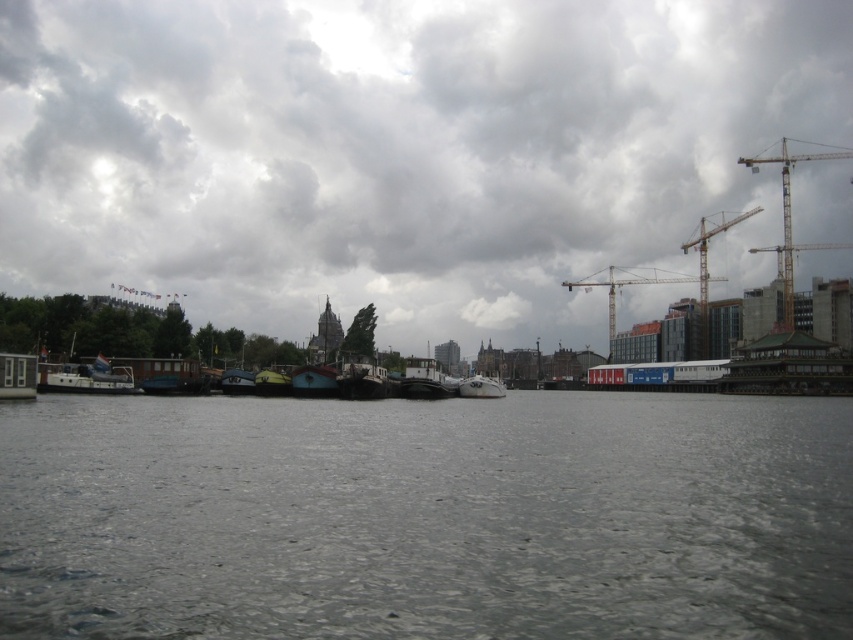
You are a photographer planning to capture the reflection of the teal glossy boat at center in the gray water at center. Based on the scene description, will the reflection be visible?

The gray water at center is below the teal glossy boat at center, so the boat is above the water. Since the water is calm and reflective, the reflection of the teal glossy boat at center should be visible in the gray water at center.

You are standing on the riverbank and want to reach the point marked at coordinates point (132,394). If your maximum comfortable walking distance is 75 meters, will you be able to walk to that point without feeling too tired?

The point (132,394) is 82.39 meters away from the viewer. Since this distance exceeds your maximum comfortable walking distance of 75 meters, you will feel too tired if you walk to that point.